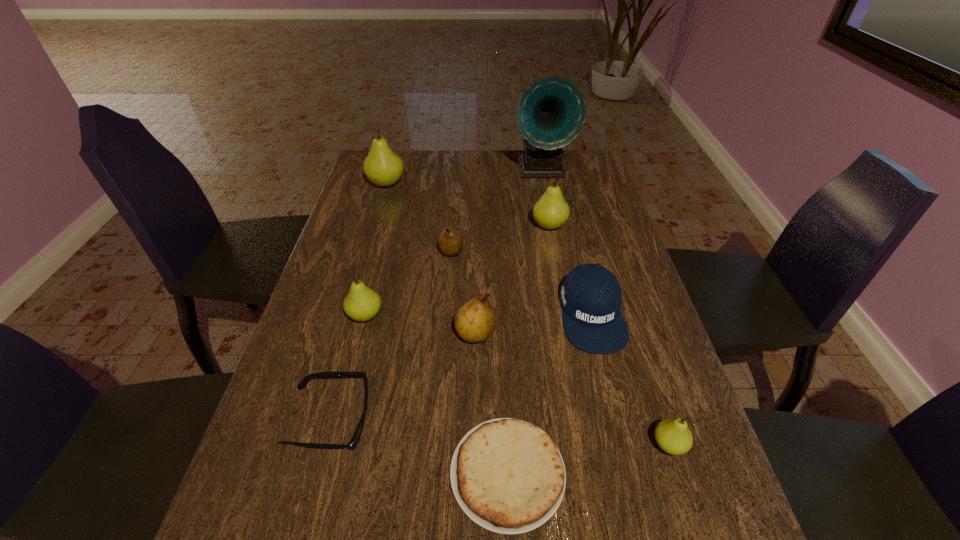
At what (x,y) coordinates should I click in order to perform the action: click on the nearest green pear. Please return your answer as a coordinate pair (x, y). The height and width of the screenshot is (540, 960). Looking at the image, I should click on (673, 436).

Locate an element on the screen. The image size is (960, 540). the smallest green pear is located at coordinates (673, 436).

This screenshot has width=960, height=540. Identify the location of the ninth tallest object. [352, 444].

Where is `beige tortilla`? The height and width of the screenshot is (540, 960). beige tortilla is located at coordinates (507, 475).

Where is `the shortest object`? the shortest object is located at coordinates (507, 475).

This screenshot has width=960, height=540. I want to click on blank space located from the horn of the tallest object, so click(x=554, y=232).

At what (x,y) coordinates should I click in order to perform the action: click on vacant space situated on the front of the biggest green pear. Please return your answer as a coordinate pair (x, y). This screenshot has height=540, width=960. Looking at the image, I should click on (369, 242).

You are a GUI agent. You are given a task and a screenshot of the screen. Output one action in this format:
    pyautogui.click(x=<x>, y=<y>)
    Task: Click on the free space located on the back of the second green pear from right to left
    
    Given the screenshot: What is the action you would take?
    pyautogui.click(x=545, y=203)

In order to click on vacant area situated 0.290m on the right of the second nearest green pear in this screenshot , I will do `click(501, 316)`.

Identify the location of free space located on the front of the nearer brown pear. (474, 515).